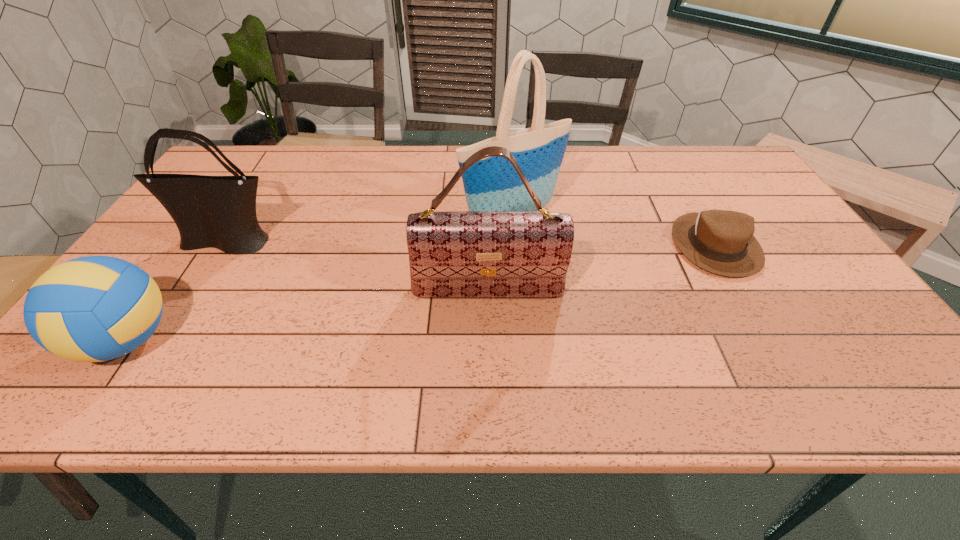
Locate an element on the screen. vacant space located 0.200m on the feather side of the shortest object is located at coordinates (774, 346).

You are a GUI agent. You are given a task and a screenshot of the screen. Output one action in this format:
    pyautogui.click(x=<x>, y=<y>)
    Task: Click on the object located at the near edge
    The image size is (960, 540).
    Given the screenshot: What is the action you would take?
    pyautogui.click(x=96, y=308)

The image size is (960, 540). I want to click on shoulder bag at the left edge, so click(x=219, y=212).

Where is `volleyball present at the left edge`? The image size is (960, 540). volleyball present at the left edge is located at coordinates tap(96, 308).

Image resolution: width=960 pixels, height=540 pixels. Find the location of `object positioned at the right edge`. object positioned at the right edge is located at coordinates click(719, 241).

You are a GUI agent. You are given a task and a screenshot of the screen. Output one action in this format:
    pyautogui.click(x=<x>, y=<y>)
    Task: Click on the object that is at the near left corner
    This screenshot has height=540, width=960.
    Given the screenshot: What is the action you would take?
    pos(96,308)

Locate an element on the screen. This screenshot has height=540, width=960. free space at the far edge of the desktop is located at coordinates (346, 153).

Locate an element on the screen. Image resolution: width=960 pixels, height=540 pixels. blank space at the near edge of the desktop is located at coordinates 278,377.

The width and height of the screenshot is (960, 540). In the image, there is a desktop. In order to click on vacant area at the left edge in this screenshot , I will do `click(193, 256)`.

Locate an element on the screen. This screenshot has width=960, height=540. free region at the near left corner is located at coordinates (82, 401).